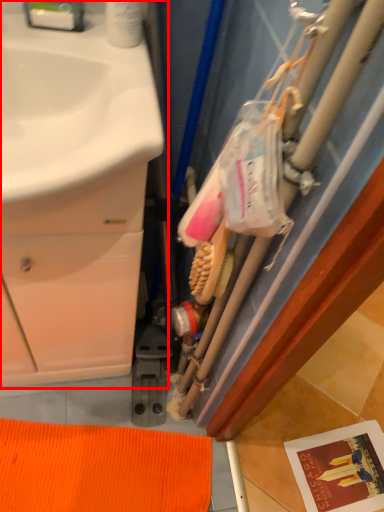
Question: Where is bathroom cabinet (annotated by the red box) located in relation to brush in the image?

Choices:
 (A) right
 (B) left

Answer: (B)